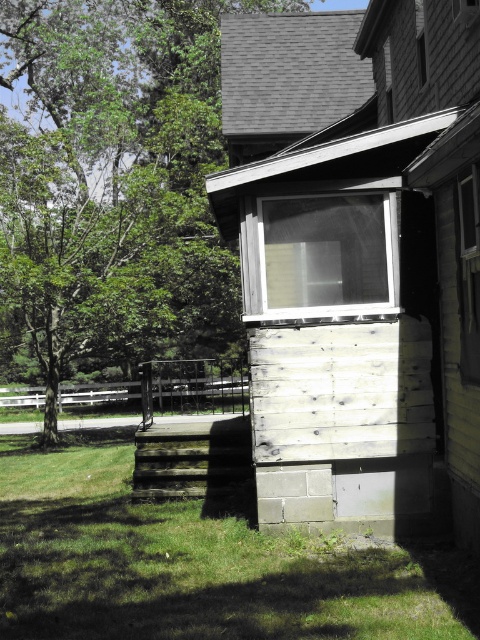
You are standing on the grassy lawn and want to move towards the house. Which object, the green leafy tree at upper left or the green grass at lower left, is closer to you?

The green grass at lower left is closer to you since it is located at your current position on the lawn, while the green leafy tree at upper left is further away.

You are standing at the point marked as point (112, 180) on the image. What object is located exactly at that point?

The green leafy tree at upper left is located exactly at point (112, 180).

You are standing on the grassy lawn and want to walk to the house. Which object, the green leafy tree at upper left or the green grass at lower left, is closer to you as you approach the house?

Result: The green leafy tree at upper left is closer to you because it is further to the viewer than the green grass at lower left, meaning it is nearer in your line of sight as you approach the house.